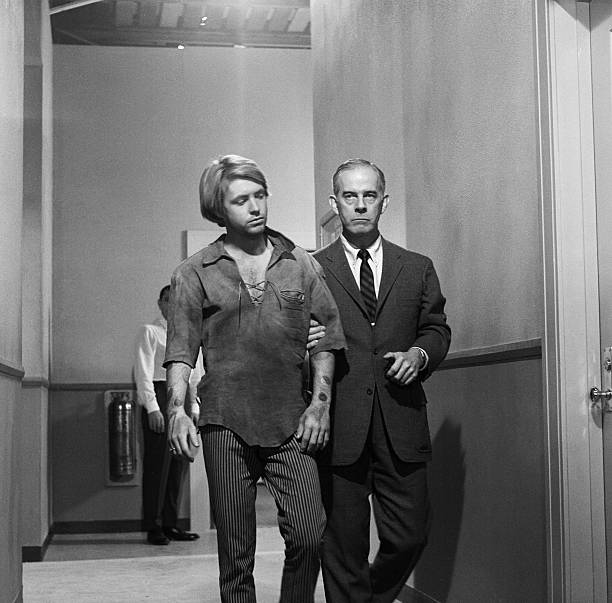
Where is `wall trim`? The image size is (612, 603). wall trim is located at coordinates (8, 365), (35, 380), (43, 383), (62, 387), (477, 355).